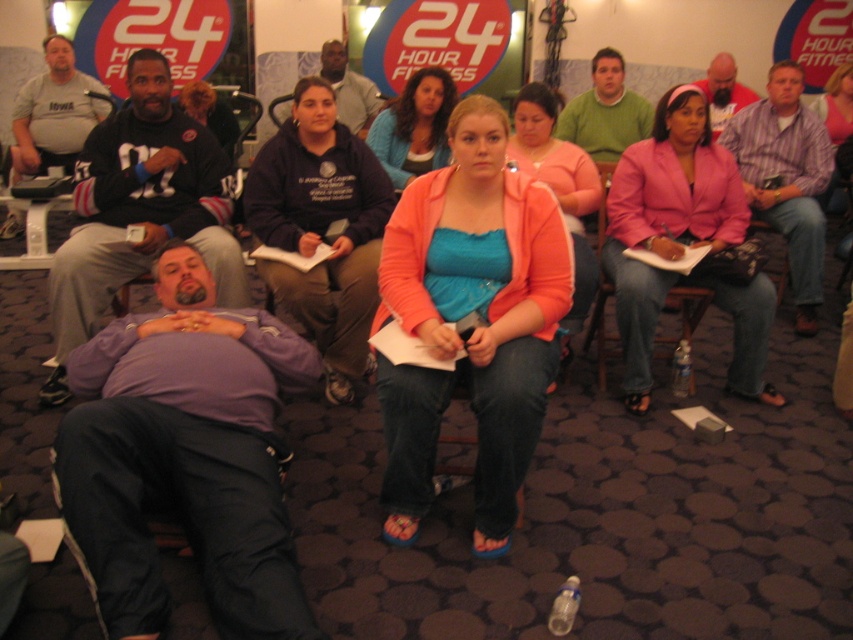
Is point (527, 275) less distant than point (218, 141)?

Yes, point (527, 275) is in front of point (218, 141).

This screenshot has height=640, width=853. What do you see at coordinates (483, 296) in the screenshot? I see `orange cotton cardigan at center` at bounding box center [483, 296].

The width and height of the screenshot is (853, 640). Identify the location of orange cotton cardigan at center. (483, 296).

Between dark gray hoodie at center and beige fabric shirt at center, which one appears on the right side from the viewer's perspective?

Positioned to the right is beige fabric shirt at center.

Between dark gray hoodie at center and beige fabric shirt at center, which one appears on the left side from the viewer's perspective?

From the viewer's perspective, dark gray hoodie at center appears more on the left side.

What do you see at coordinates (138, 209) in the screenshot? I see `dark gray hoodie at center` at bounding box center [138, 209].

Find the location of a particular element. This screenshot has height=640, width=853. dark gray hoodie at center is located at coordinates (138, 209).

Between point (426, 234) and point (335, 106), which one is positioned behind?

The point (335, 106) is more distant.

Between orange cotton cardigan at center and dark blue hoodie at center, which one is positioned higher?

Positioned higher is dark blue hoodie at center.

Between point (451, 388) and point (370, 93), which one is positioned behind?

The point (370, 93) is more distant.

Image resolution: width=853 pixels, height=640 pixels. I want to click on orange cotton cardigan at center, so pos(483,296).